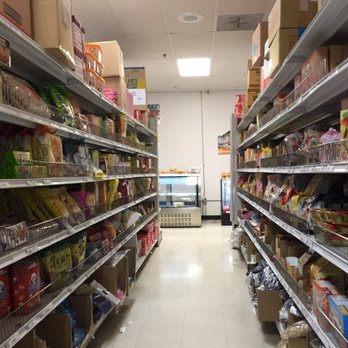
Identify the location of display glass. The image size is (348, 348). (178, 193).